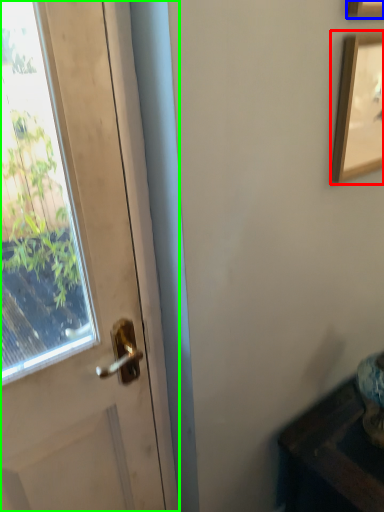
Question: Which object is the farthest from picture frame (highlighted by a red box)? Choose among these: picture frame (highlighted by a blue box) or door (highlighted by a green box).

Choices:
 (A) picture frame
 (B) door

Answer: (B)